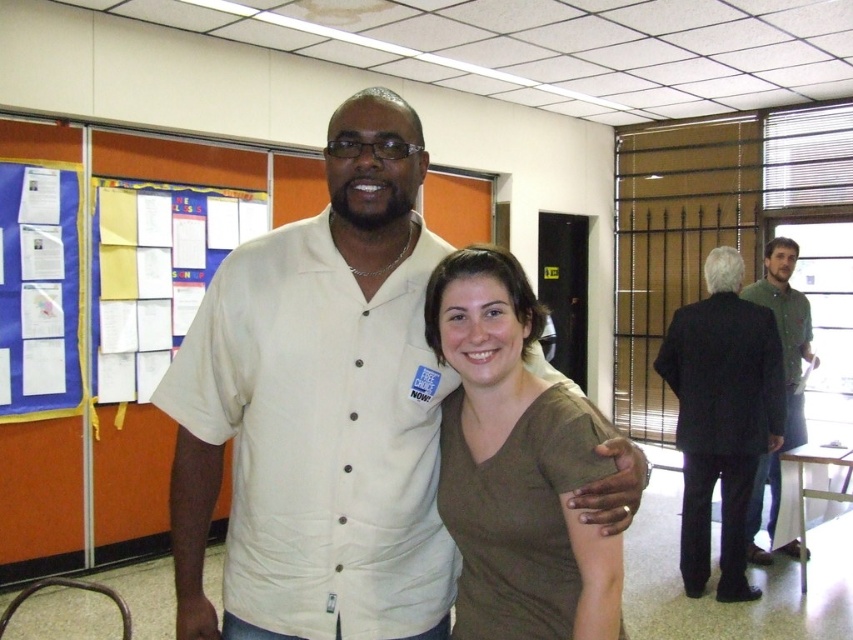
Is brown matte shirt at center in front of black suit at right?

Yes, brown matte shirt at center is closer to the viewer.

What do you see at coordinates (514, 465) in the screenshot? I see `brown matte shirt at center` at bounding box center [514, 465].

Where is `brown matte shirt at center`? brown matte shirt at center is located at coordinates (514, 465).

Locate an element on the screen. This screenshot has width=853, height=640. brown matte shirt at center is located at coordinates (514, 465).

Does white button-down shirt at center appear under black suit at right?

Incorrect, white button-down shirt at center is not positioned below black suit at right.

Can you confirm if white button-down shirt at center is positioned to the left of black suit at right?

Yes, white button-down shirt at center is to the left of black suit at right.

I want to click on white button-down shirt at center, so click(x=318, y=410).

Which is below, white button-down shirt at center or brown matte shirt at center?

brown matte shirt at center is below.

Is point (180, 420) behind point (462, 440)?

That is False.

Image resolution: width=853 pixels, height=640 pixels. I want to click on white button-down shirt at center, so click(x=318, y=410).